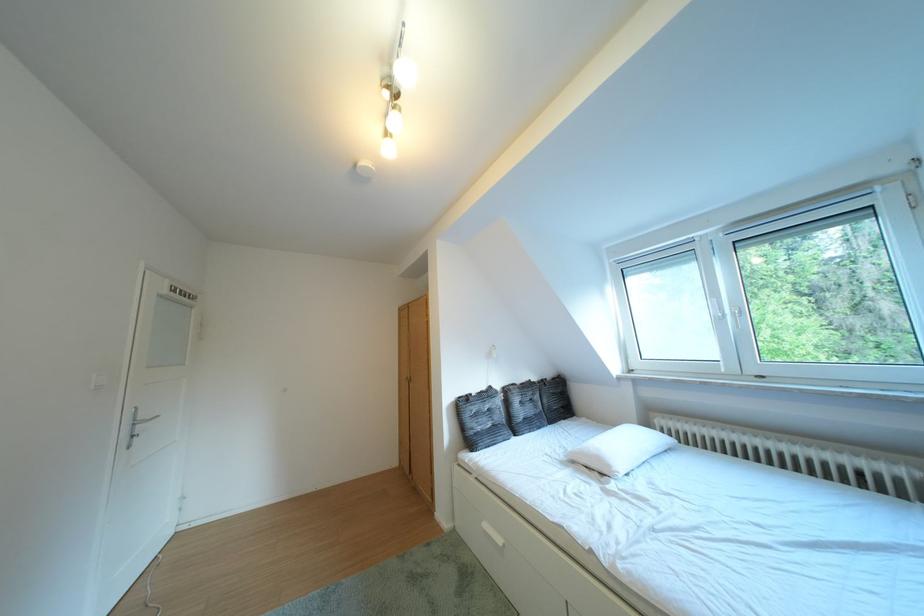
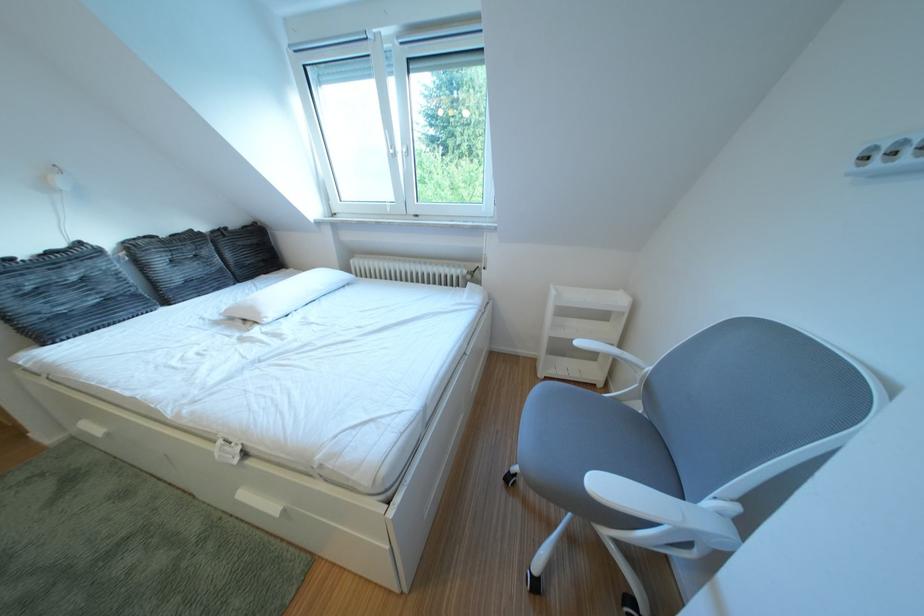
Where in the second image is the point corresponding to point (563, 379) from the first image?

(247, 228)